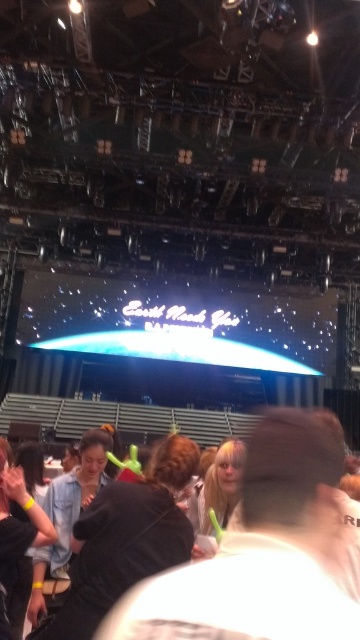
What do you see at coordinates (259, 552) in the screenshot?
I see `black matte jacket at center` at bounding box center [259, 552].

Is point (309, 513) closer to viewer compared to point (29, 545)?

Yes.

Which is in front, point (231, 600) or point (11, 531)?

Point (231, 600) is more forward.

Image resolution: width=360 pixels, height=640 pixels. Identify the location of black matte jacket at center. (259, 552).

In the scene shown: Who is positioned more to the left, black matte jacket at center or black fabric at center?

From the viewer's perspective, black fabric at center appears more on the left side.

Is the position of black matte jacket at center less distant than that of black fabric at center?

Yes, black matte jacket at center is closer to the viewer.

Who is more distant from viewer, (254, 602) or (159, 486)?

The point (159, 486) is more distant.

At what (x,y) coordinates should I click in order to perform the action: click on black matte jacket at center. Please return your answer as a coordinate pair (x, y). The width and height of the screenshot is (360, 640). Looking at the image, I should click on pyautogui.click(x=259, y=552).

Between black fabric at center and black matte hair at lower left, which one has less height?

With less height is black matte hair at lower left.

Who is higher up, black fabric at center or black matte hair at lower left?

black fabric at center is higher up.

Does point (149, 545) come behind point (18, 547)?

No, it is not.

Find the location of a particular element. The width and height of the screenshot is (360, 640). black fabric at center is located at coordinates (125, 538).